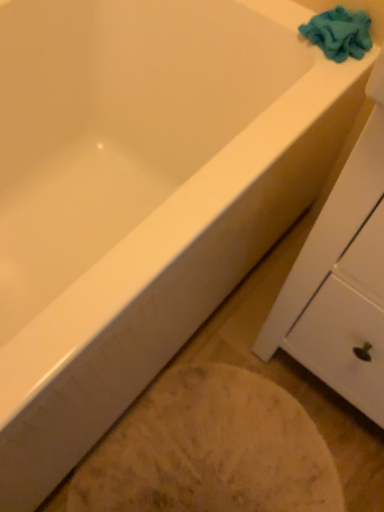
Question: Is white matte cabinet at upper right facing towards white glossy bathtub at lower left?

Choices:
 (A) no
 (B) yes

Answer: (B)

Question: From a real-world perspective, is white matte cabinet at upper right positioned over white glossy bathtub at lower left based on gravity?

Choices:
 (A) no
 (B) yes

Answer: (B)

Question: Is white matte cabinet at upper right positioned in front of white glossy bathtub at lower left?

Choices:
 (A) no
 (B) yes

Answer: (B)

Question: Are white matte cabinet at upper right and white glossy bathtub at lower left far apart?

Choices:
 (A) yes
 (B) no

Answer: (B)

Question: Can you confirm if white matte cabinet at upper right is wider than white glossy bathtub at lower left?

Choices:
 (A) yes
 (B) no

Answer: (B)

Question: Does point (331, 25) appear closer or farther from the camera than point (203, 437)?

Choices:
 (A) closer
 (B) farther

Answer: (A)

Question: In the image, is blue fuzzy towel at upper right positioned in front of or behind white glossy bathtub at lower left?

Choices:
 (A) front
 (B) behind

Answer: (B)

Question: From a real-world perspective, is blue fuzzy towel at upper right physically located above or below white glossy bathtub at lower left?

Choices:
 (A) above
 (B) below

Answer: (A)

Question: Is blue fuzzy towel at upper right bigger or smaller than white glossy bathtub at lower left?

Choices:
 (A) small
 (B) big

Answer: (A)

Question: Looking at the image, does white matte cabinet at upper right seem bigger or smaller compared to blue fuzzy towel at upper right?

Choices:
 (A) small
 (B) big

Answer: (B)

Question: Considering their positions, is white matte cabinet at upper right located in front of or behind blue fuzzy towel at upper right?

Choices:
 (A) front
 (B) behind

Answer: (A)

Question: Is white matte cabinet at upper right to the left or to the right of blue fuzzy towel at upper right in the image?

Choices:
 (A) left
 (B) right

Answer: (B)

Question: From the image's perspective, is white matte cabinet at upper right positioned above or below blue fuzzy towel at upper right?

Choices:
 (A) below
 (B) above

Answer: (A)

Question: Which is correct: white glossy bathtub at lower left is inside blue fuzzy towel at upper right, or outside of it?

Choices:
 (A) outside
 (B) inside

Answer: (A)

Question: Based on their positions, is white glossy bathtub at lower left located to the left or right of blue fuzzy towel at upper right?

Choices:
 (A) left
 (B) right

Answer: (A)